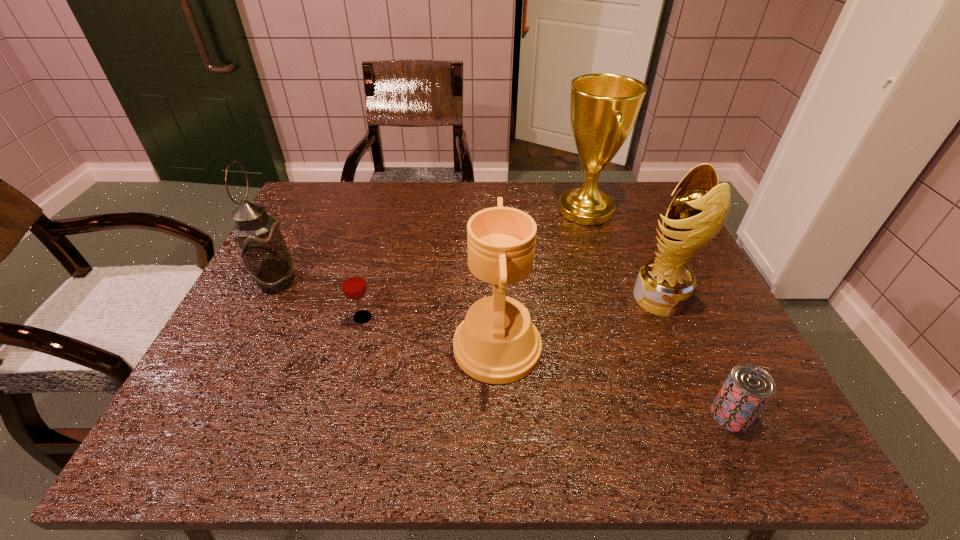
Find the location of a particular element. The height and width of the screenshot is (540, 960). object identified as the closest to the oil lamp is located at coordinates (354, 286).

Identify the location of object identified as the closest to the farthest object. (664, 286).

Choose which award is the nearest neighbor to the shortest object. Please provide its 2D coordinates. Your answer should be formatted as a tuple, i.e. [(x, y)], where the tuple contains the x and y coordinates of a point satisfying the conditions above.

[(664, 286)]

Identify which award is the second closest to the leftmost award. Please provide its 2D coordinates. Your answer should be formatted as a tuple, i.e. [(x, y)], where the tuple contains the x and y coordinates of a point satisfying the conditions above.

[(604, 107)]

Image resolution: width=960 pixels, height=540 pixels. Identify the location of free spot that satisfies the following two spatial constraints: 1. by the handles of the farthest object; 2. on the back side of the nearest object. (651, 415).

At what (x,y) coordinates should I click in order to perform the action: click on vacant region that satisfies the following two spatial constraints: 1. by the handles of the farthest award; 2. on the front side of the oil lamp. Please return your answer as a coordinate pair (x, y). Looking at the image, I should click on (609, 282).

At what (x,y) coordinates should I click in order to perform the action: click on free space that satisfies the following two spatial constraints: 1. by the handles of the farthest award; 2. on the front side of the leftmost object. Please return your answer as a coordinate pair (x, y). Image resolution: width=960 pixels, height=540 pixels. Looking at the image, I should click on (609, 282).

This screenshot has height=540, width=960. In order to click on vacant space that satisfies the following two spatial constraints: 1. on the front side of the oil lamp; 2. on the left side of the second shortest object in this screenshot , I will do `click(258, 318)`.